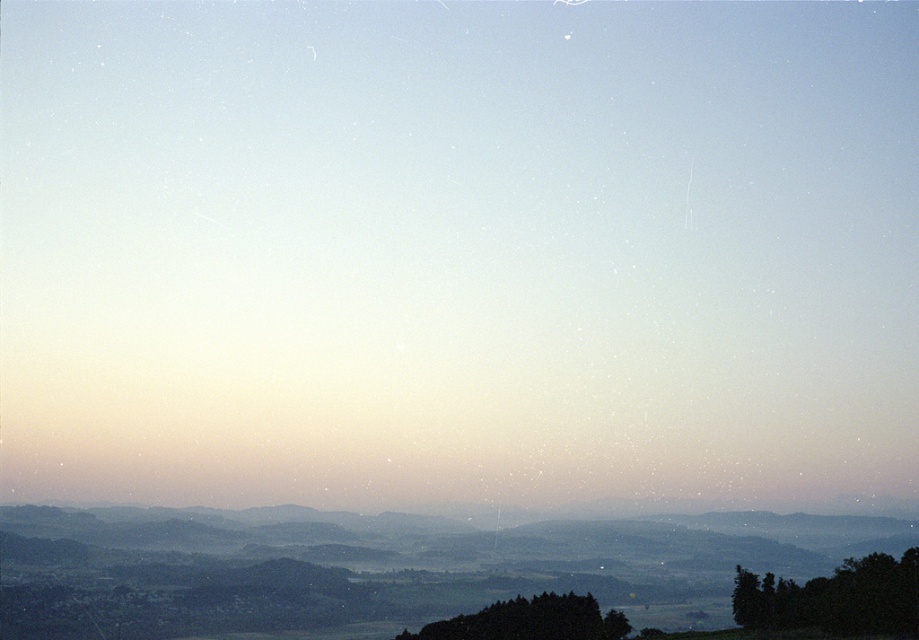
Is green leafy tree at lower right wider than dark green textured tree at lower center?

No.

Is green leafy tree at lower right to the right of dark green textured tree at lower center from the viewer's perspective?

Indeed, green leafy tree at lower right is positioned on the right side of dark green textured tree at lower center.

This screenshot has height=640, width=919. What do you see at coordinates (835, 598) in the screenshot?
I see `green leafy tree at lower right` at bounding box center [835, 598].

This screenshot has height=640, width=919. Find the location of `green leafy tree at lower right`. green leafy tree at lower right is located at coordinates (835, 598).